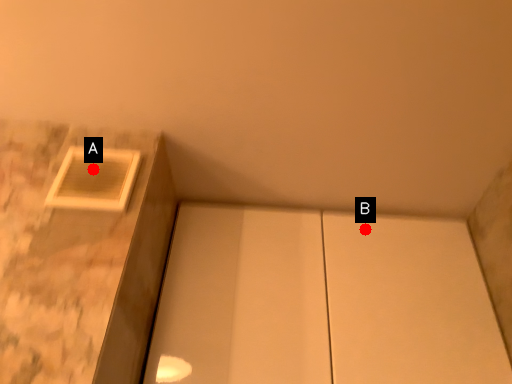
Question: Two points are circled on the image, labeled by A and B beside each circle. Which of the following is the farthest from the observer?

Choices:
 (A) A is further
 (B) B is further

Answer: (B)